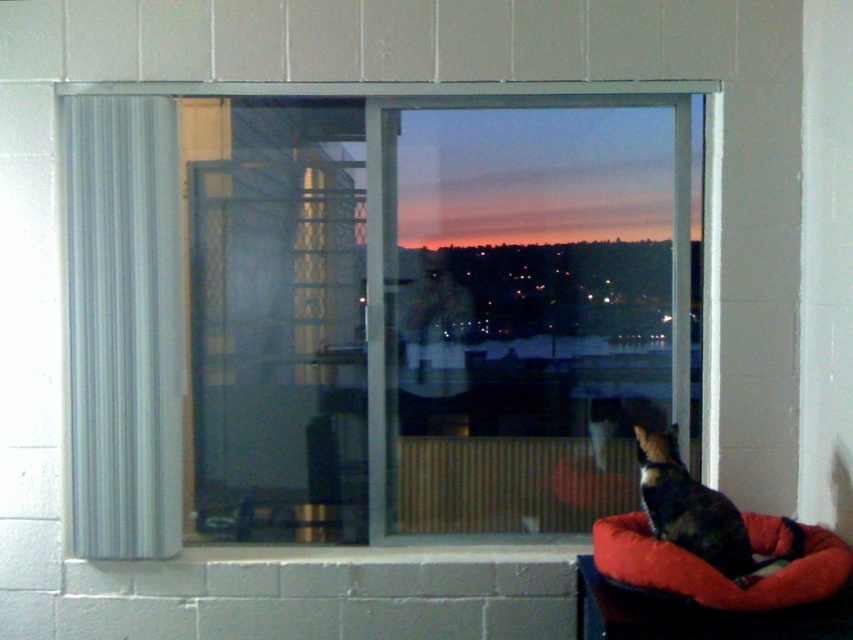
Can you confirm if transparent glass window at center is wider than white fabric curtain at left?

Correct, the width of transparent glass window at center exceeds that of white fabric curtain at left.

Between transparent glass window at center and white fabric curtain at left, which one is positioned lower?

white fabric curtain at left is lower down.

Is point (438, 412) farther from camera compared to point (80, 424)?

Yes.

At what (x,y) coordinates should I click in order to perform the action: click on transparent glass window at center. Please return your answer as a coordinate pair (x, y). Looking at the image, I should click on point(370,307).

Is red plush dog bed at lower right bigger than calico fur cat at lower right?

Yes, red plush dog bed at lower right is bigger than calico fur cat at lower right.

Identify the location of red plush dog bed at lower right. The height and width of the screenshot is (640, 853). coord(712,586).

Is point (770, 538) less distant than point (695, 504)?

That is False.

Image resolution: width=853 pixels, height=640 pixels. Identify the location of red plush dog bed at lower right. (712, 586).

How far apart are transparent glass window at center and red plush dog bed at lower right?

35.15 inches

Does point (561, 136) lie in front of point (762, 529)?

That is False.

At what (x,y) coordinates should I click in order to perform the action: click on transparent glass window at center. Please return your answer as a coordinate pair (x, y). The height and width of the screenshot is (640, 853). Looking at the image, I should click on (370, 307).